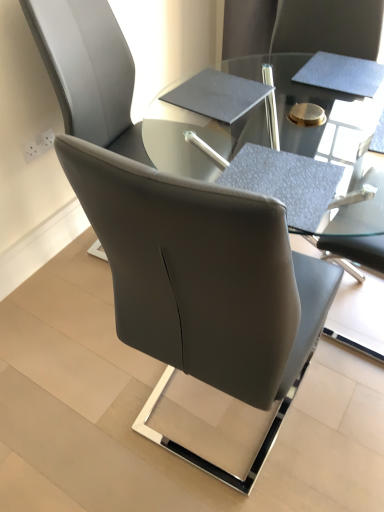
Question: Considering the positions of matte gray table at center and satin black chair at center in the image, is matte gray table at center wider or thinner than satin black chair at center?

Choices:
 (A) wide
 (B) thin

Answer: (B)

Question: Is matte gray table at center inside the boundaries of satin black chair at center, or outside?

Choices:
 (A) inside
 (B) outside

Answer: (B)

Question: Estimate the real-world distances between objects in this image. Which object is closer to the satin black chair at center?

Choices:
 (A) matte gray table at center
 (B) textured gray notepad at upper right
 (C) black matte notebook at center

Answer: (A)

Question: Which object is positioned closest to the textured gray notepad at upper right?

Choices:
 (A) matte gray table at center
 (B) black matte notebook at center
 (C) satin black chair at center

Answer: (A)